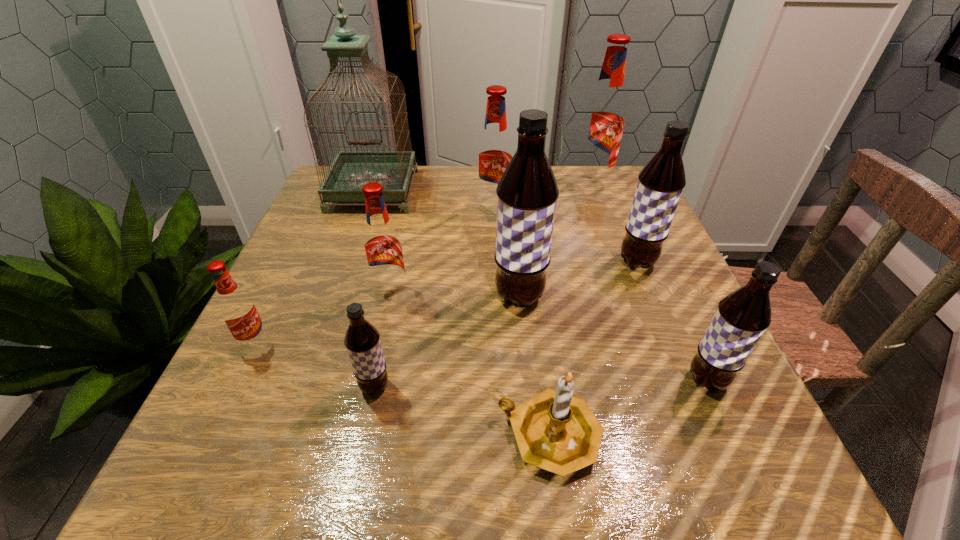
In order to click on the second nearest red root beer in this screenshot , I will do `click(383, 250)`.

Find the location of a particular element. Image resolution: width=960 pixels, height=540 pixels. the third red root beer from right to left is located at coordinates (383, 250).

Locate an element on the screen. the second smallest brown root beer is located at coordinates (741, 318).

The height and width of the screenshot is (540, 960). I want to click on the smallest red root beer, so click(x=236, y=307).

This screenshot has width=960, height=540. In order to click on the fourth nearest object in this screenshot , I will do `click(236, 307)`.

The image size is (960, 540). Find the location of `the smallest brown root beer`. the smallest brown root beer is located at coordinates (362, 340).

You are a GUI agent. You are given a task and a screenshot of the screen. Output one action in this format:
    pyautogui.click(x=<x>, y=<y>)
    Task: Click on the gold candle holder
    
    Given the screenshot: What is the action you would take?
    (555, 431)

The height and width of the screenshot is (540, 960). In order to click on candle holder in this screenshot , I will do `click(555, 431)`.

The width and height of the screenshot is (960, 540). Identify the location of blank area located at the door of the tallest object. (339, 291).

At what (x,y) coordinates should I click in order to perform the action: click on vacant space located on the left of the biggest brown root beer. Please return your answer as a coordinate pair (x, y). Looking at the image, I should click on (446, 297).